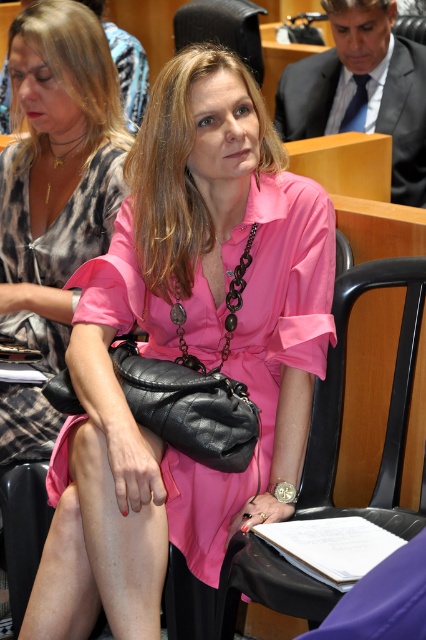
Question: Does matte black purse at center have a lesser width compared to black leather chair at center?

Choices:
 (A) yes
 (B) no

Answer: (B)

Question: Which object is the farthest from the matte black purse at center?

Choices:
 (A) pink satin dress at center
 (B) black leather chair at center

Answer: (A)

Question: Which of the following is the farthest from the observer?

Choices:
 (A) matte black purse at center
 (B) black leather chair at center

Answer: (A)

Question: Does matte black purse at center appear over black leather chair at center?

Choices:
 (A) no
 (B) yes

Answer: (B)

Question: From the image, what is the correct spatial relationship of black leather chair at center in relation to pink satin dress at center?

Choices:
 (A) below
 (B) above

Answer: (A)

Question: Which of the following is the farthest from the observer?

Choices:
 (A) (396, 406)
 (B) (46, 440)
 (C) (166, 554)

Answer: (B)